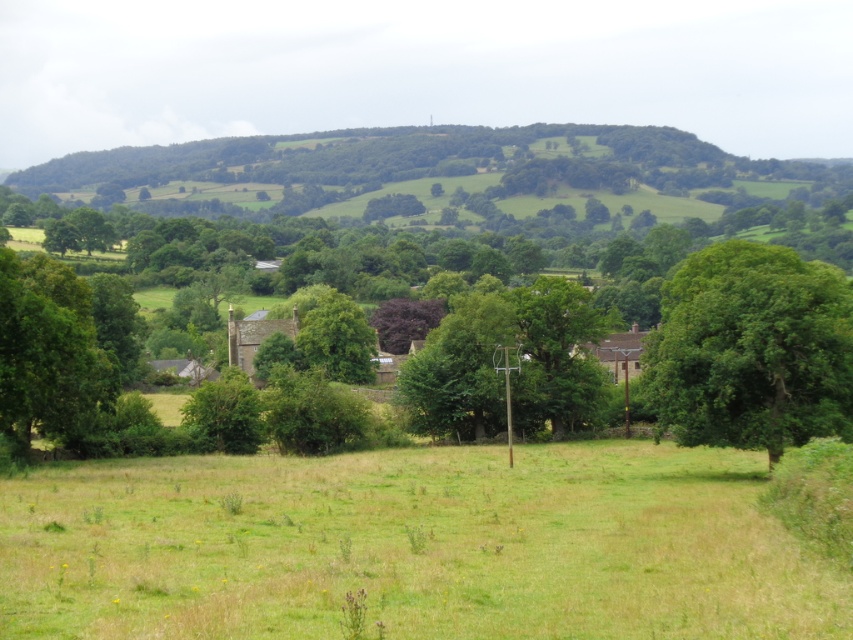
Does green leafy tree at right have a greater width compared to green leafy tree at left?

Correct, the width of green leafy tree at right exceeds that of green leafy tree at left.

The image size is (853, 640). In order to click on green leafy tree at right in this screenshot , I will do `click(751, 349)`.

I want to click on green leafy tree at right, so click(x=751, y=349).

Can you confirm if green grass at lower center is positioned above green leafy tree at right?

No.

Is point (770, 570) farther from camera compared to point (740, 264)?

No, it is not.

The image size is (853, 640). I want to click on green grass at lower center, so click(412, 545).

Does green grass at lower center have a greater width compared to green leafy tree at left?

Indeed, green grass at lower center has a greater width compared to green leafy tree at left.

Is green grass at lower center shorter than green leafy tree at left?

Correct, green grass at lower center is not as tall as green leafy tree at left.

Is point (566, 481) closer to viewer compared to point (97, 376)?

That is True.

You are a GUI agent. You are given a task and a screenshot of the screen. Output one action in this format:
    pyautogui.click(x=<x>, y=<y>)
    Task: Click on the green grass at lower center
    The width and height of the screenshot is (853, 640).
    Given the screenshot: What is the action you would take?
    pyautogui.click(x=412, y=545)